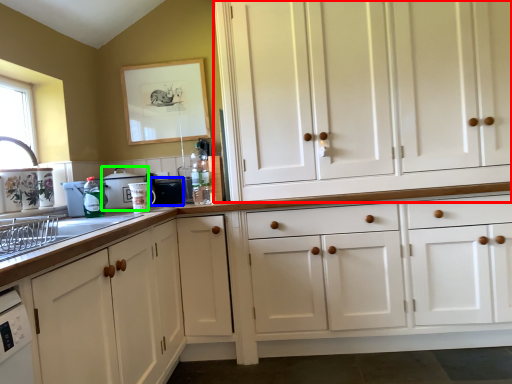
Question: Considering the real-world distances, which object is closest to cabinetry (highlighted by a red box)? appliance (highlighted by a blue box) or appliance (highlighted by a green box).

Choices:
 (A) appliance
 (B) appliance

Answer: (A)